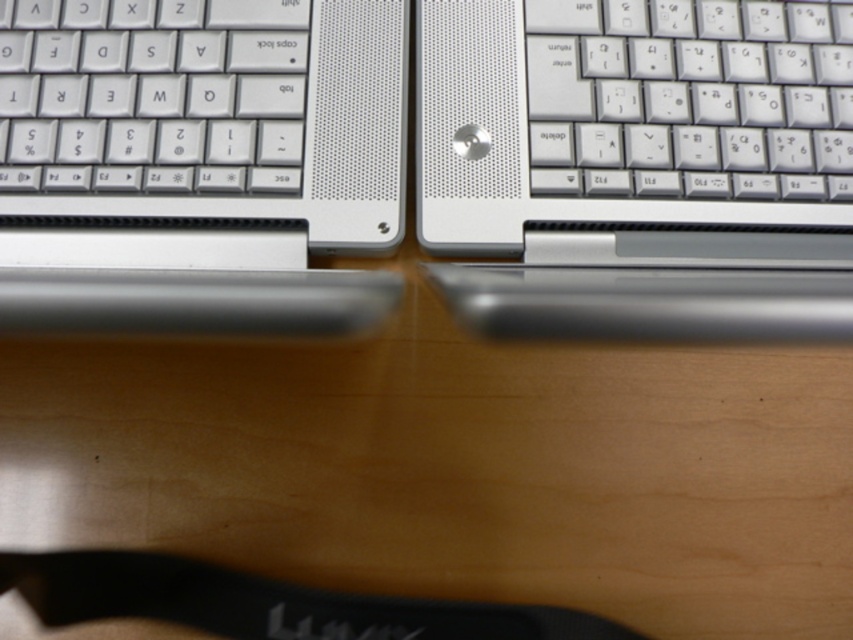
You are setting up a workspace and need to place a 12 inch ruler between the white plastic keyboard at upper right and the white plastic keyboard at left. Based on the image, will the ruler fit between them?

The distance between the white plastic keyboard at upper right and the white plastic keyboard at left is 10.38 inches, which is shorter than the 12 inch ruler. Therefore, the ruler will not fit between them.

You are holding a smartphone that is 6 inches long. You want to take a photo of the satin silver laptop at left from a distance where the laptop will fill the entire frame of your camera. Based on the description, will the laptop fit in the frame if you position yourself 23.64 inches away?

The satin silver laptop at left is 23.64 inches from viewer. Since the laptop is positioned at that exact distance, and your smartphone is only 6 inches long, the laptop will not fit entirely within the frame because its length exceeds the camera sensor or lens field of view at that distance. You may need to step back further or use a wider angle lens.

You are positioning a new laptop on the wooden surface. The existing satin silver laptop at left is at point 0.256, 0.233. If you want to place the new laptop exactly 0.1 units to the right of the existing one, what will be the new coordinates?

The new coordinates would be 0.256 plus 0.1 in the x direction, so (198, 227).